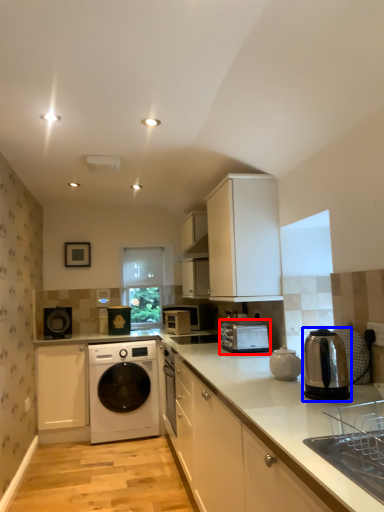
Question: Which of the following is the farthest to the observer, home appliance (highlighted by a red box) or home appliance (highlighted by a blue box)?

Choices:
 (A) home appliance
 (B) home appliance

Answer: (A)